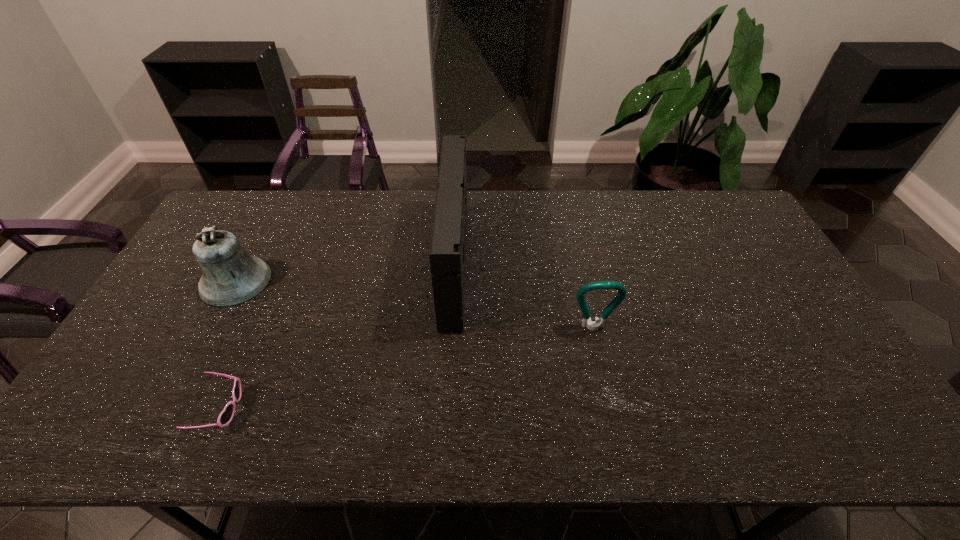
Identify the location of object that stands as the closest to the bell. The image size is (960, 540). (226, 416).

Choose which object is the third nearest neighbor to the nearest object. Please provide its 2D coordinates. Your answer should be formatted as a tuple, i.e. [(x, y)], where the tuple contains the x and y coordinates of a point satisfying the conditions above.

[(594, 325)]

This screenshot has width=960, height=540. Identify the location of vacant position in the image that satisfies the following two spatial constraints: 1. at the jaws of the bottle opener; 2. on the front-facing side of the shortest object. (612, 409).

Find the location of `vacant space that satisfies the following two spatial constraints: 1. at the jaws of the rightmost object; 2. on the front-facing side of the sunglasses`. vacant space that satisfies the following two spatial constraints: 1. at the jaws of the rightmost object; 2. on the front-facing side of the sunglasses is located at coordinates (612, 409).

Image resolution: width=960 pixels, height=540 pixels. I want to click on vacant region that satisfies the following two spatial constraints: 1. at the jaws of the bottle opener; 2. on the front-facing side of the nearest object, so click(612, 409).